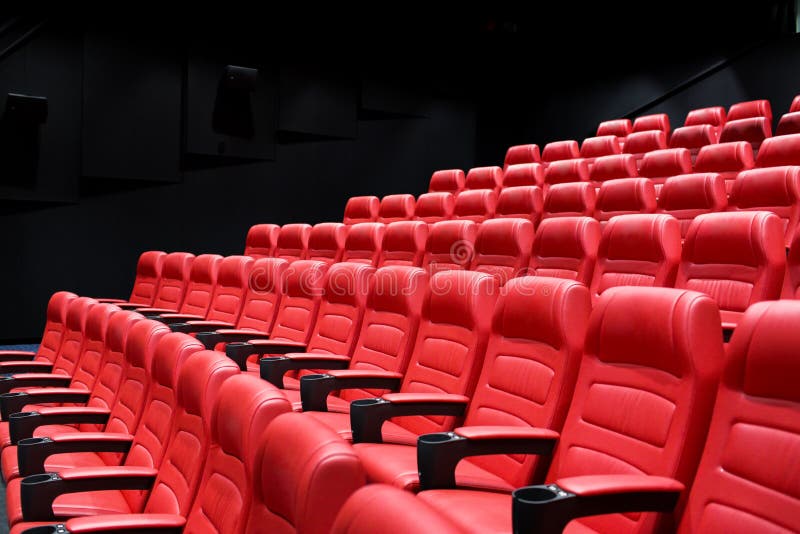
Find the location of `theater seat in first row`. theater seat in first row is located at coordinates (356, 515), (294, 452), (240, 404), (205, 374), (170, 352), (137, 339), (113, 329), (92, 321), (73, 312), (53, 303).